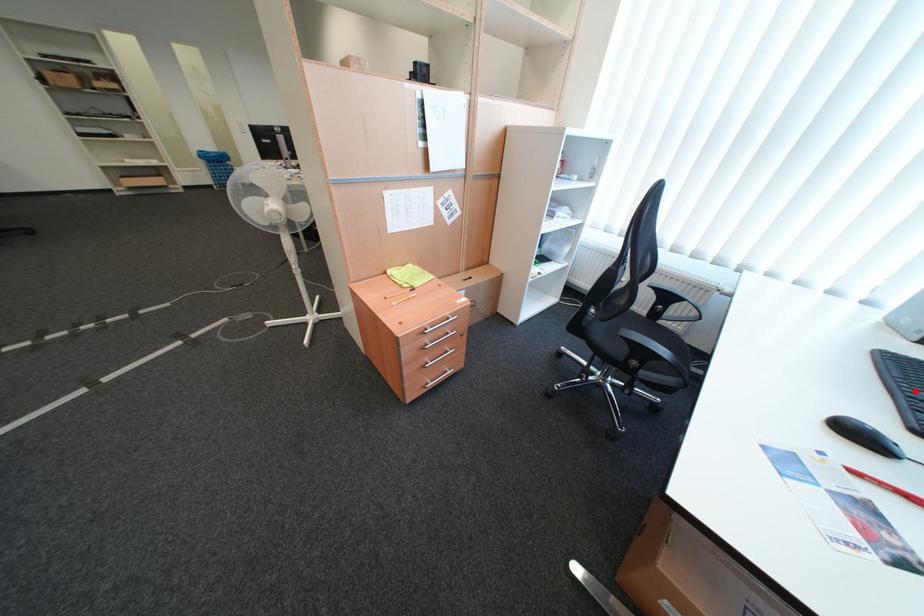
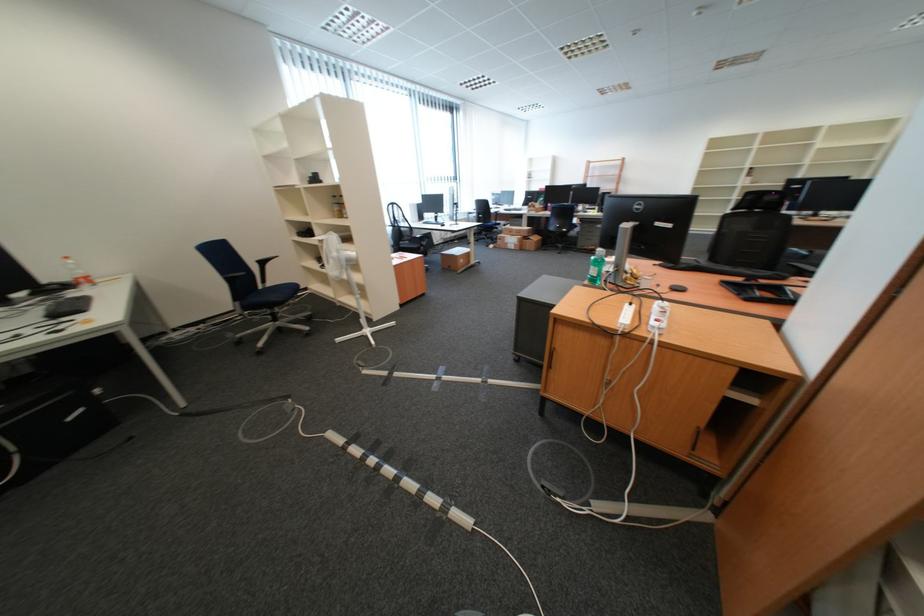
Question: I am providing you with two images of the same scene from different viewpoints. A red point is marked on the first image. At the location where the point appears in image 1, is it still visible in image 2?

Choices:
 (A) Yes
 (B) No

Answer: (B)